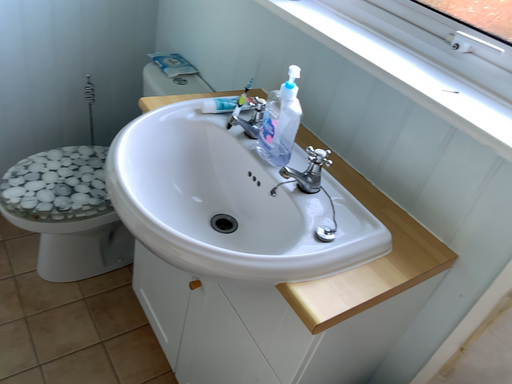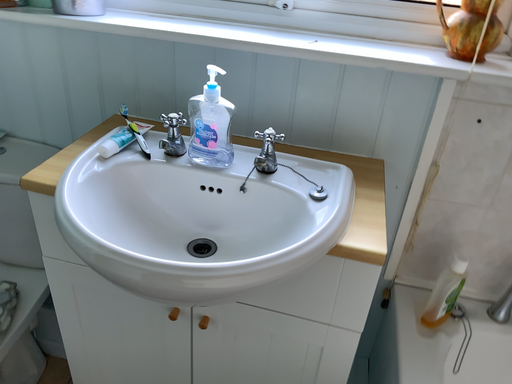
Question: Which way did the camera rotate in the video?

Choices:
 (A) rotated left
 (B) rotated right

Answer: (B)